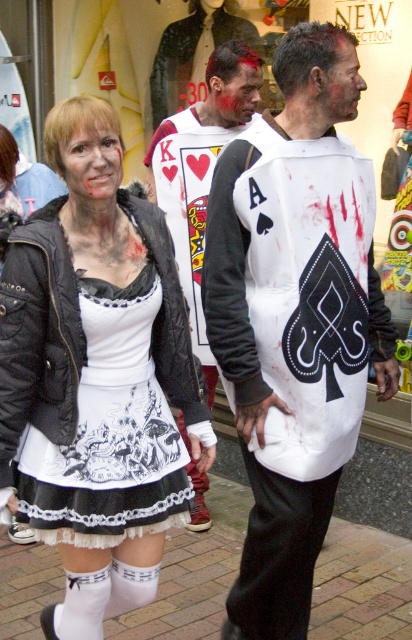
You are a costume designer who needs to ensure that the two white garments at the center of the image, the white matte vest at center and the white jersey at center, are positioned correctly for a photo shoot. According to the description, what is the minimum distance you should maintain between them to avoid overlapping in the photo?

The white matte vest at center and white jersey at center are 1.13 meters apart, so the minimum distance to maintain between them should be at least 1.13 meters to avoid overlapping in the photo.